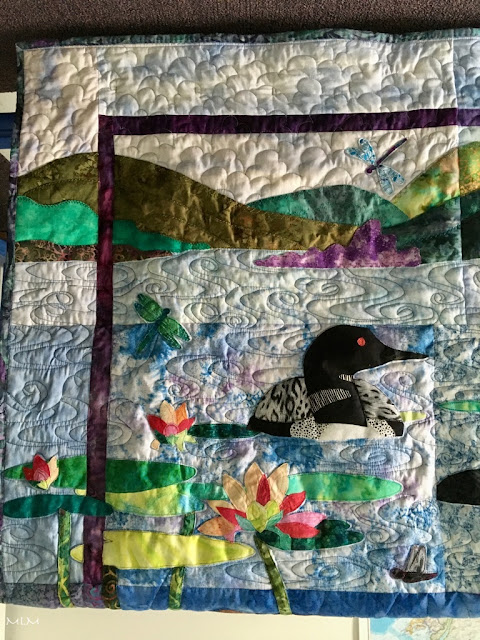
What are the coordinates of `dark green lily pad design on quilt` in the screenshot? It's located at (136, 468), (112, 481).